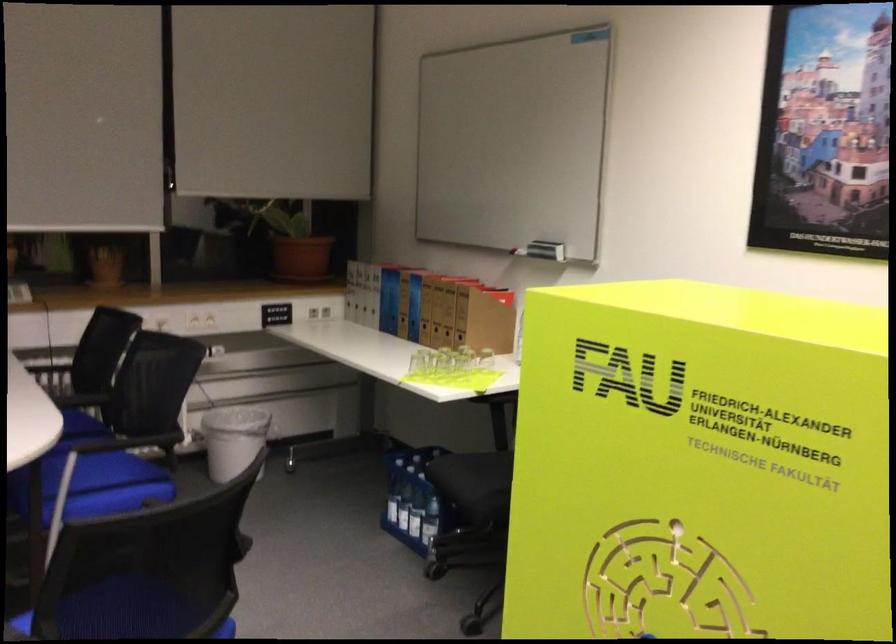
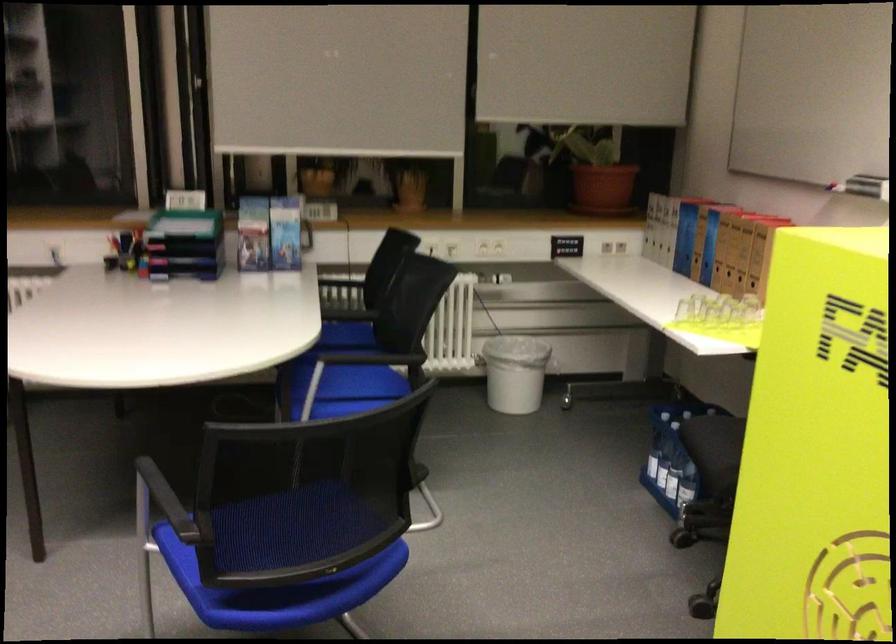
Where in the second image is the point corresponding to pixel 436 310 from the first image?

(730, 251)